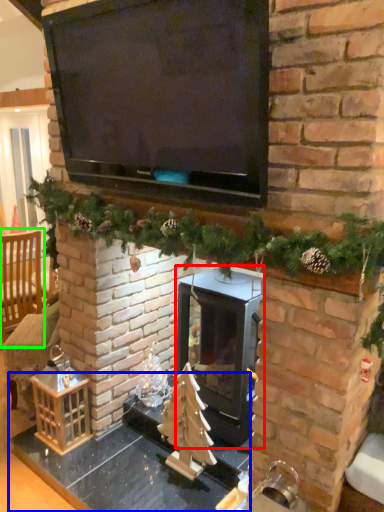
Question: Considering the real-world distances, which object is farthest from wood burning stove (highlighted by a red box)? table (highlighted by a blue box) or armchair (highlighted by a green box)?

Choices:
 (A) table
 (B) armchair

Answer: (B)